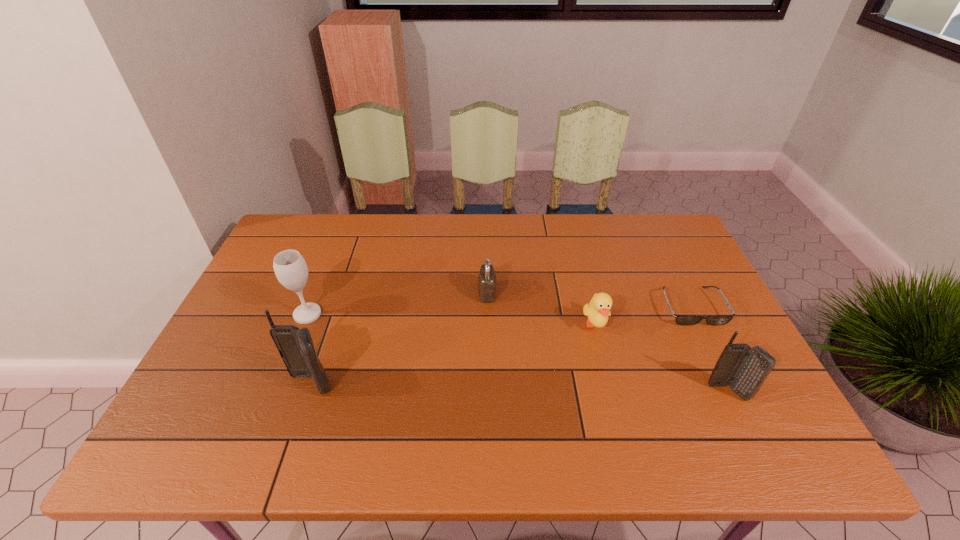
If we want them evenly spaced by inserting an extra cellular_telephone among them, please locate a free spot for this new cellular_telephone. Please provide its 2D coordinates. Your answer should be formatted as a tuple, i.e. [(x, y)], where the tuple contains the x and y coordinates of a point satisfying the conditions above.

[(517, 388)]